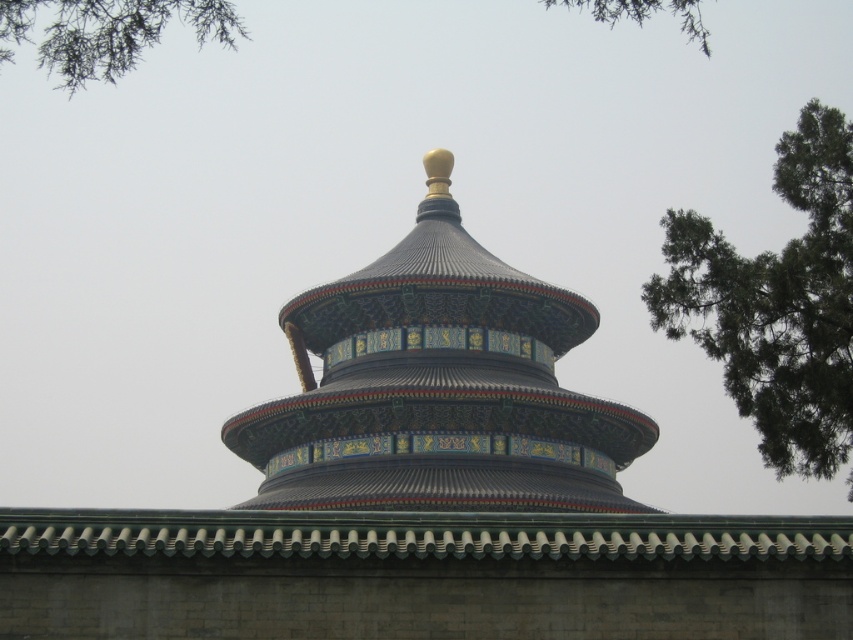
Between green leafy tree at upper left and green leafy branch at upper right, which one appears on the right side from the viewer's perspective?

green leafy branch at upper right

Is point (76, 20) positioned behind point (706, 35)?

No, it is in front of (706, 35).

This screenshot has width=853, height=640. Find the location of `green leafy tree at upper left`. green leafy tree at upper left is located at coordinates (105, 33).

Is glossy ceramic dome at center below green leafy branch at upper right?

Correct, glossy ceramic dome at center is located below green leafy branch at upper right.

Does point (364, 355) come closer to viewer compared to point (656, 3)?

No, (364, 355) is further to viewer.

Find the location of a particular element. Image resolution: width=853 pixels, height=640 pixels. glossy ceramic dome at center is located at coordinates (438, 387).

Is green leafy tree at upper right thinner than green leafy tree at upper left?

Indeed, green leafy tree at upper right has a lesser width compared to green leafy tree at upper left.

Locate an element on the screen. Image resolution: width=853 pixels, height=640 pixels. green leafy tree at upper right is located at coordinates coord(776,304).